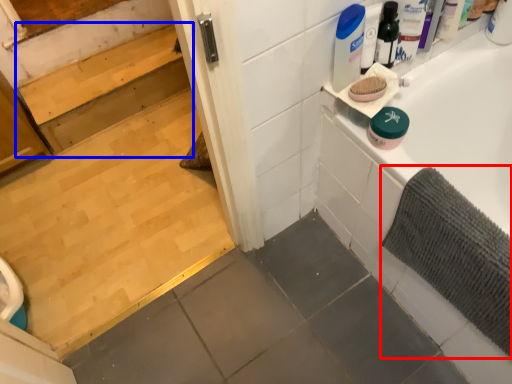
Question: Which object appears farthest to the camera in this image, bath mat (highlighted by a red box) or stair (highlighted by a blue box)?

Choices:
 (A) bath mat
 (B) stair

Answer: (B)